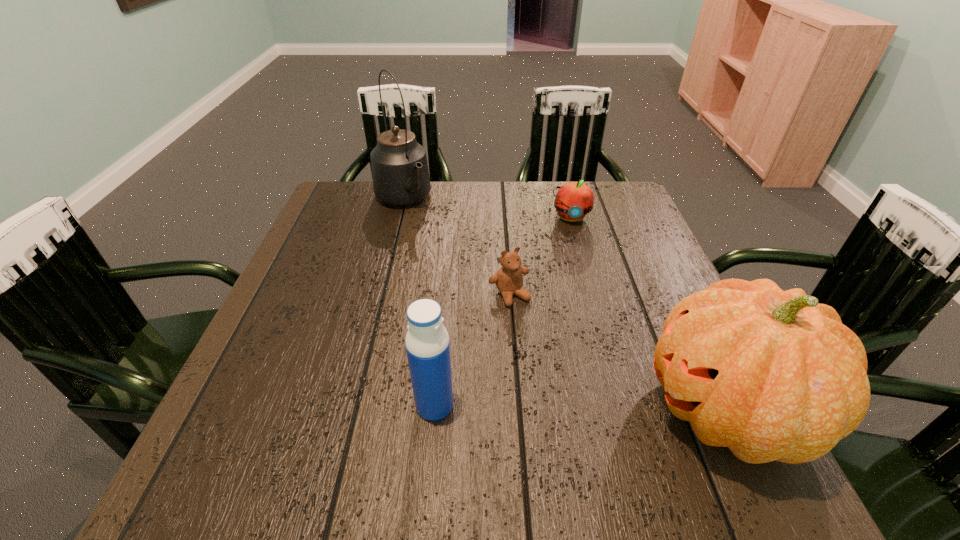
Identify the location of vacant space on the desktop that is between the water bottle and the second tallest object and is positioned on the surface of the apple. (589, 407).

At what (x,y) coordinates should I click in order to perform the action: click on vacant spot on the desktop that is between the water bottle and the fourth shortest object and is positioned on the face of the teddy bear. Please return your answer as a coordinate pair (x, y). This screenshot has height=540, width=960. Looking at the image, I should click on (586, 407).

Where is `vacant space on the desktop that is between the third tallest object and the pumpkin and is positioned spout on the leftmost object`? This screenshot has height=540, width=960. vacant space on the desktop that is between the third tallest object and the pumpkin and is positioned spout on the leftmost object is located at coordinates (588, 407).